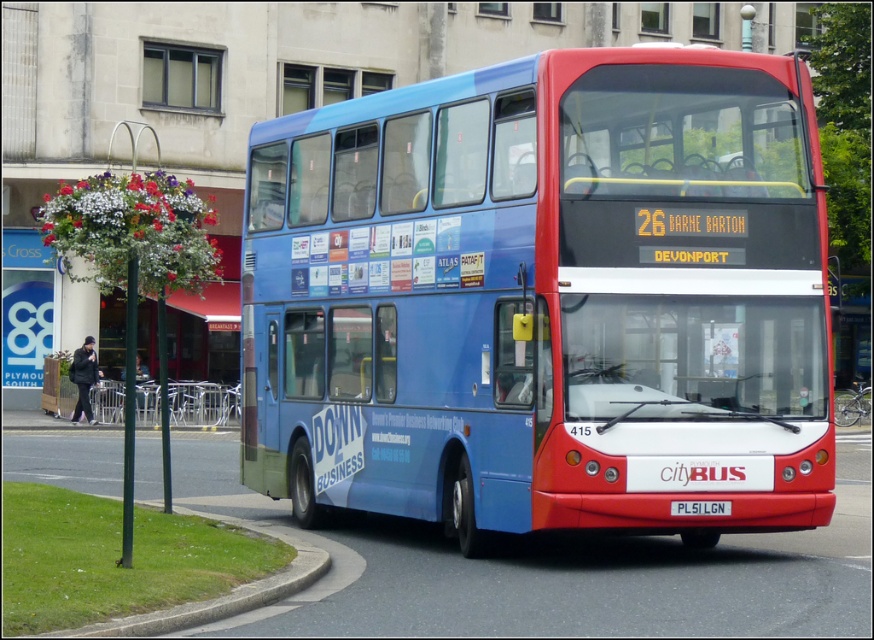
Measure the distance between blue matte bus at center and white plastic license plate at center.

They are 1.57 meters apart.

Can you confirm if blue matte bus at center is smaller than white plastic license plate at center?

Incorrect, blue matte bus at center is not smaller in size than white plastic license plate at center.

The image size is (874, 640). Identify the location of blue matte bus at center. (545, 298).

Identify the location of blue matte bus at center. This screenshot has height=640, width=874. (545, 298).